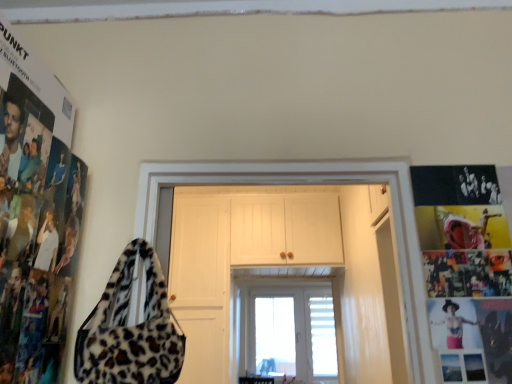
Question: From the image's perspective, is black matte poster at right on white wooden door at center?

Choices:
 (A) yes
 (B) no

Answer: (A)

Question: Is black matte poster at right outside of white wooden door at center?

Choices:
 (A) yes
 (B) no

Answer: (A)

Question: Is black matte poster at right positioned behind white wooden door at center?

Choices:
 (A) yes
 (B) no

Answer: (B)

Question: Does black matte poster at right come in front of white wooden door at center?

Choices:
 (A) no
 (B) yes

Answer: (B)

Question: Is black matte poster at right oriented away from white wooden door at center?

Choices:
 (A) yes
 (B) no

Answer: (A)

Question: Does black matte poster at right appear on the left side of white wooden door at center?

Choices:
 (A) no
 (B) yes

Answer: (A)

Question: Can you confirm if leather-like red pants at lower right is wider than transparent glass door at center?

Choices:
 (A) yes
 (B) no

Answer: (B)

Question: Is leather-like red pants at lower right looking in the opposite direction of transparent glass door at center?

Choices:
 (A) yes
 (B) no

Answer: (A)

Question: From a real-world perspective, is leather-like red pants at lower right below transparent glass door at center?

Choices:
 (A) yes
 (B) no

Answer: (A)

Question: Considering the relative sizes of leather-like red pants at lower right and transparent glass door at center in the image provided, is leather-like red pants at lower right taller than transparent glass door at center?

Choices:
 (A) yes
 (B) no

Answer: (B)

Question: From a real-world perspective, is leather-like red pants at lower right over transparent glass door at center?

Choices:
 (A) no
 (B) yes

Answer: (A)

Question: Is leather-like red pants at lower right oriented towards transparent glass door at center?

Choices:
 (A) no
 (B) yes

Answer: (A)

Question: Is white wooden door at center placed right next to leather-like red pants at lower right?

Choices:
 (A) yes
 (B) no

Answer: (B)